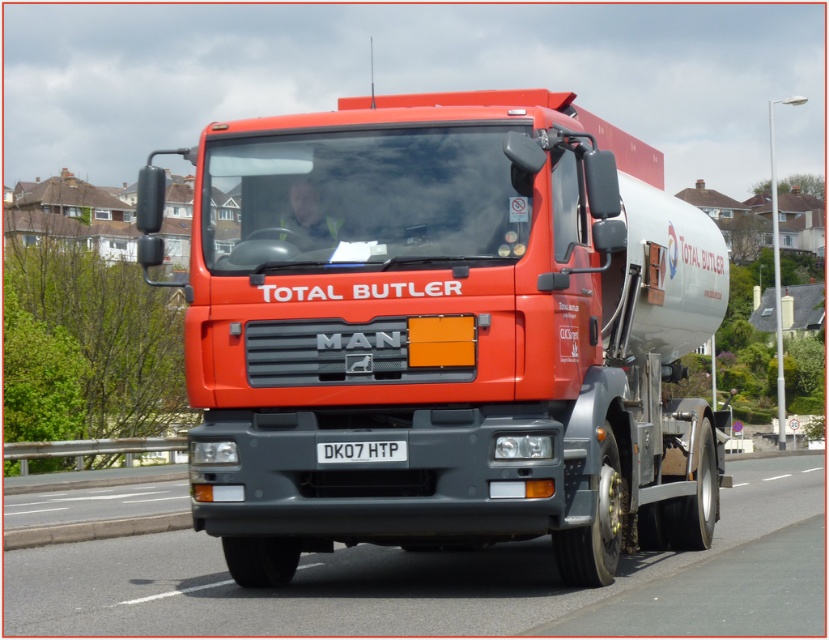
Can you confirm if metallic red trailer truck at center is positioned to the left of white plastic license plate at center?

Indeed, metallic red trailer truck at center is positioned on the left side of white plastic license plate at center.

Does point (188, 396) lie behind point (396, 445)?

Yes.

Where is `metallic red trailer truck at center`? This screenshot has height=640, width=829. metallic red trailer truck at center is located at coordinates (444, 332).

Describe the element at coordinates (444, 332) in the screenshot. This screenshot has height=640, width=829. I see `metallic red trailer truck at center` at that location.

Does metallic red trailer truck at center have a larger size compared to black rubber highway at center?

Correct, metallic red trailer truck at center is larger in size than black rubber highway at center.

Find the location of a particular element. metallic red trailer truck at center is located at coordinates (x=444, y=332).

Between black rubber highway at center and white plastic license plate at center, which one appears on the right side from the viewer's perspective?

black rubber highway at center is more to the right.

Between point (391, 621) and point (321, 452), which one is positioned behind?

Positioned behind is point (321, 452).

At what (x,y) coordinates should I click in order to perform the action: click on black rubber highway at center. Please return your answer as a coordinate pair (x, y). Image resolution: width=829 pixels, height=640 pixels. Looking at the image, I should click on (442, 580).

What are the coordinates of `black rubber highway at center` in the screenshot? It's located at (442, 580).